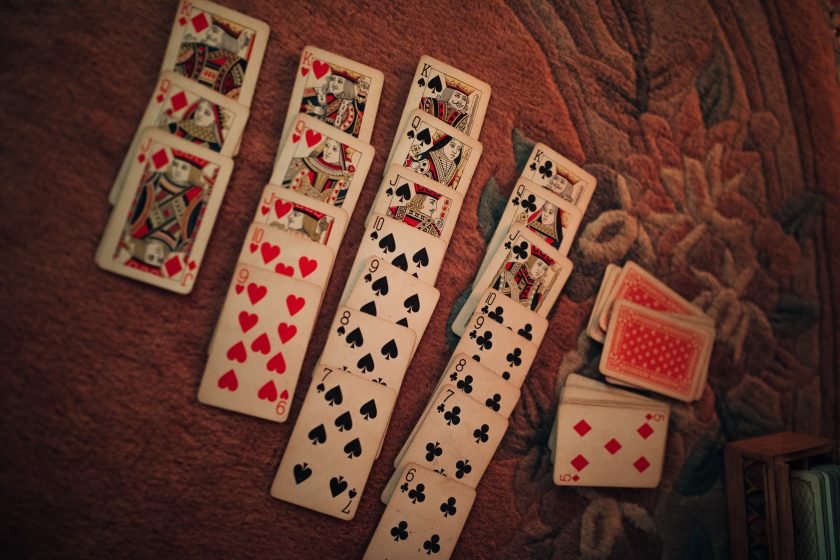
At what (x,y) coordinates should I click in order to perform the action: click on box. Please return your answer as a coordinate pair (x, y). This screenshot has height=560, width=840. Looking at the image, I should click on (751, 501).